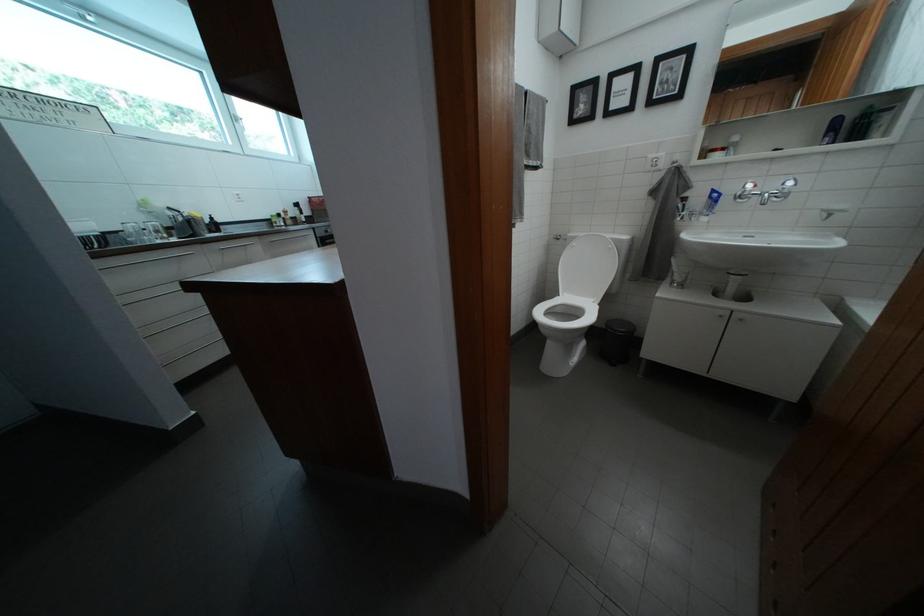
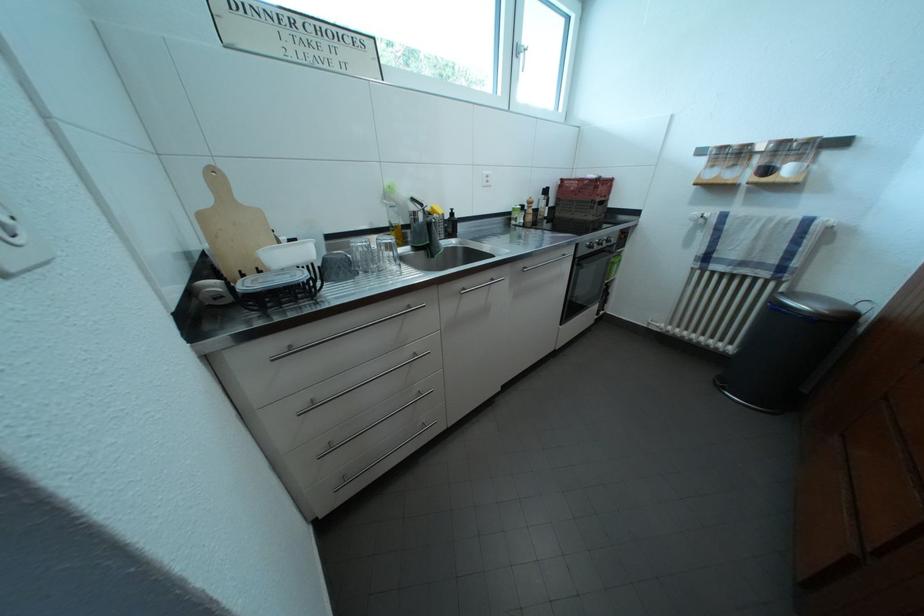
Locate, in the second image, the point that corresponds to (x=180, y=220) in the first image.

(421, 213)